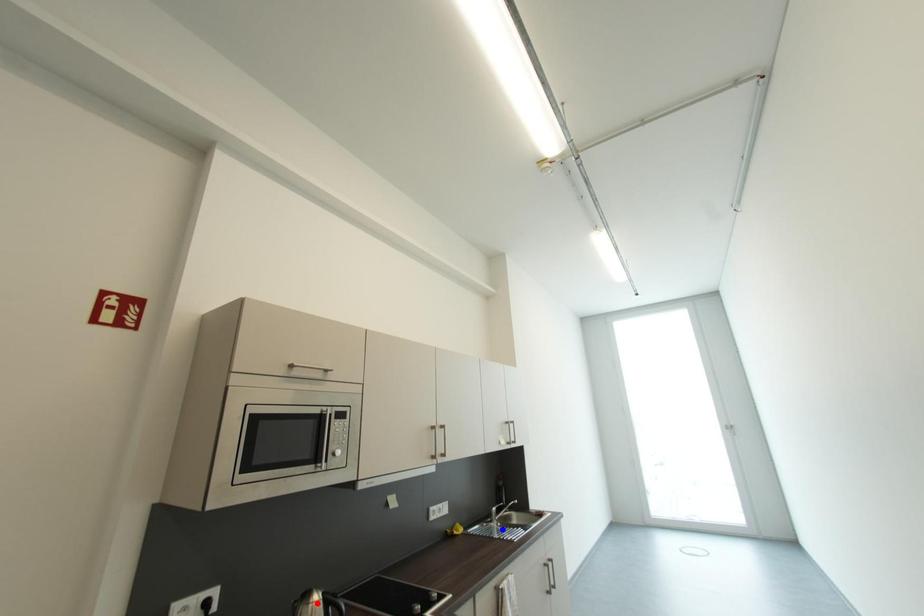
Question: In the image, two points are highlighted. Which point is nearer to the camera? Reply with the corresponding letter.

Choices:
 (A) blue point
 (B) red point

Answer: (B)